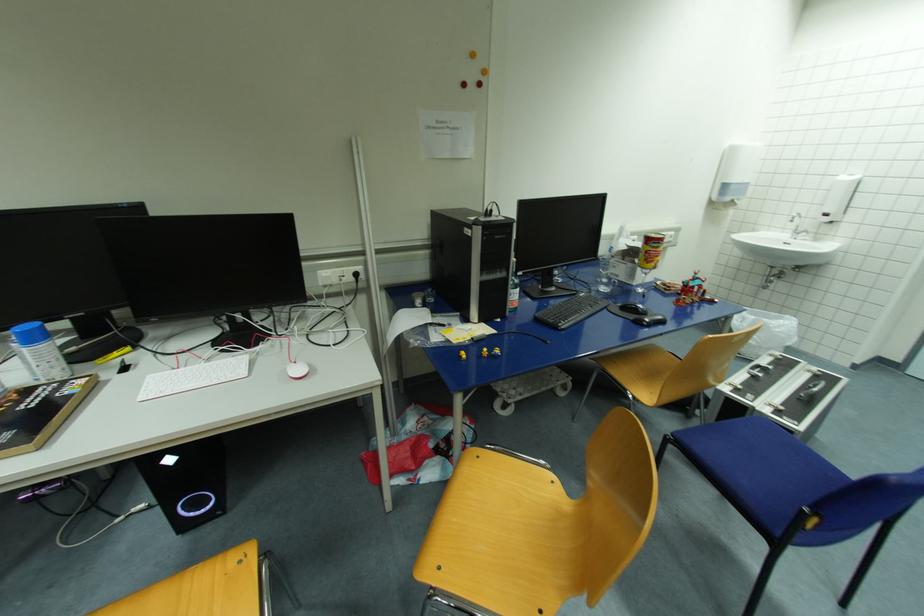
Find where to lift the blue spray can. Please return your answer as a coordinate pair (x, y).

(38, 352)